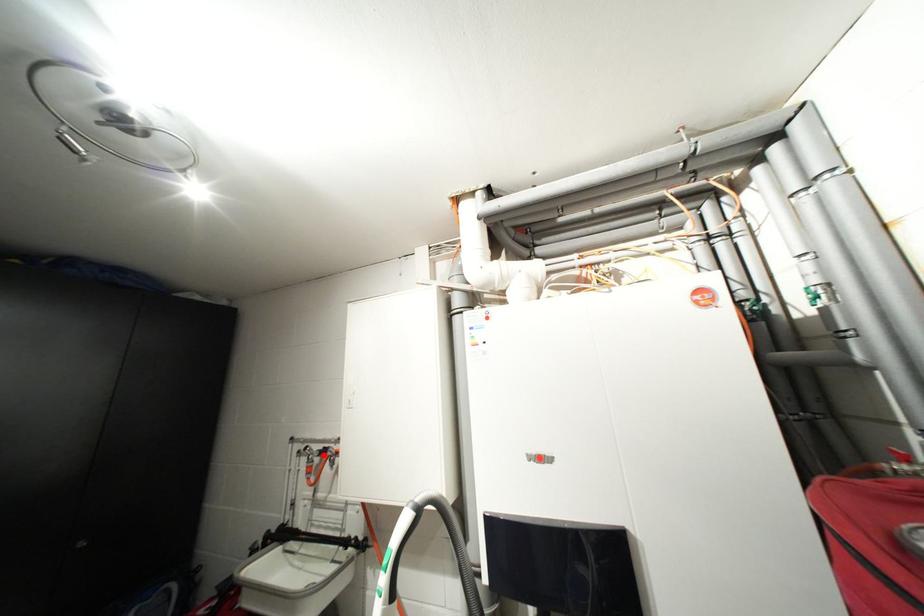
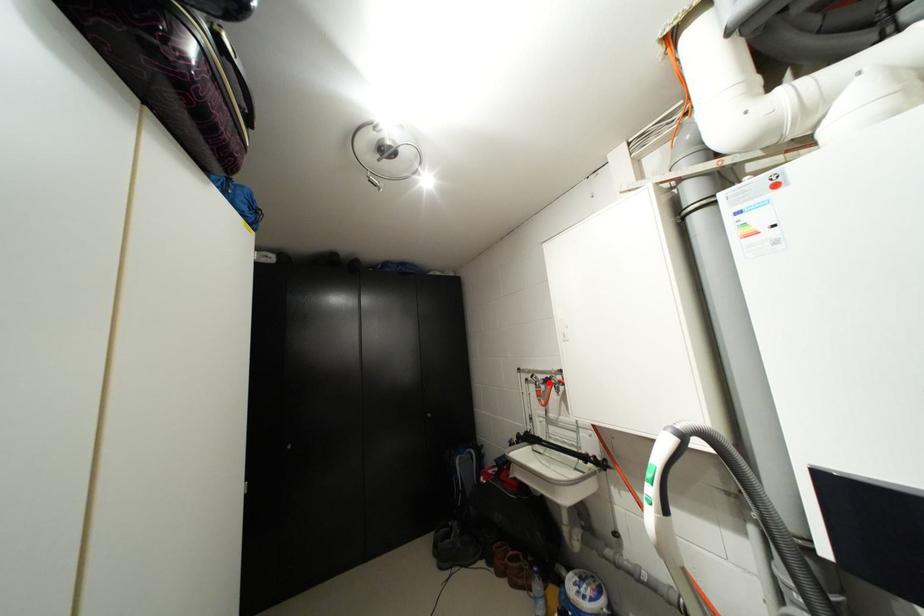
I am providing you with two images of the same scene from different viewpoints. A red point is marked on the first image and another point is marked on the second image. Does the point marked in image1 correspond to the same location as the one in image2?

Yes